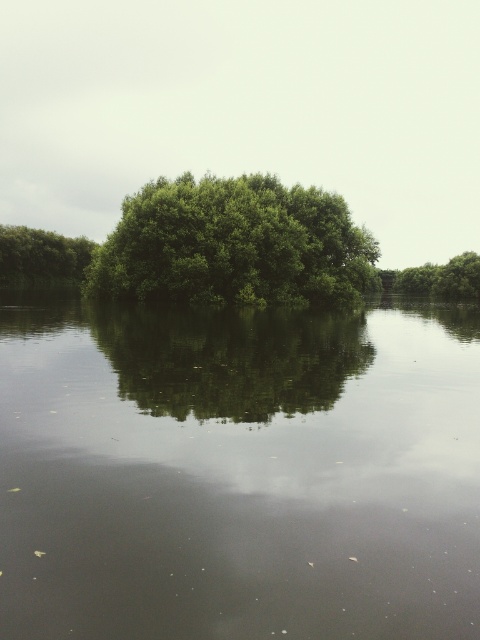
You are a bird looking for a nesting spot. You see the green leafy tree at center and the green leafy tree at left. Which tree would provide more horizontal space for your nest?

The green leafy tree at center has a larger width than the green leafy tree at left, so it would provide more horizontal space for your nest.

Looking at this image, you are observing the island from a boat anchored nearby. There are two points marked on the island, point A at coordinates point A is point (240, 600) and point B is point (311, 212). Which point is closer to your viewpoint?

Point A at coordinates point (240, 600) is closer to the camera than point B at coordinates point (311, 212), so point A is closer to your viewpoint.